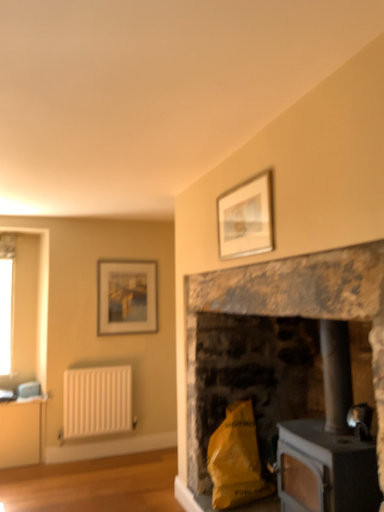
Question: Can you confirm if rustic stone fireplace at center is bigger than white textured radiator at left?

Choices:
 (A) yes
 (B) no

Answer: (A)

Question: From a real-world perspective, does rustic stone fireplace at center stand above white textured radiator at left?

Choices:
 (A) yes
 (B) no

Answer: (A)

Question: Can we say rustic stone fireplace at center lies outside white textured radiator at left?

Choices:
 (A) no
 (B) yes

Answer: (B)

Question: Can you confirm if rustic stone fireplace at center is wider than white textured radiator at left?

Choices:
 (A) yes
 (B) no

Answer: (A)

Question: Is rustic stone fireplace at center taller than white textured radiator at left?

Choices:
 (A) no
 (B) yes

Answer: (B)

Question: From their relative heights in the image, would you say black matte wood burning stove at lower right is taller or shorter than matte wooden picture frame at upper left, the second picture frame from the front?

Choices:
 (A) short
 (B) tall

Answer: (B)

Question: In the image, is black matte wood burning stove at lower right on the left side or the right side of matte wooden picture frame at upper left, the second picture frame from the front?

Choices:
 (A) right
 (B) left

Answer: (A)

Question: In the image, is black matte wood burning stove at lower right positioned in front of or behind matte wooden picture frame at upper left, which appears as the first picture frame when viewed from the back?

Choices:
 (A) behind
 (B) front

Answer: (B)

Question: From a real-world perspective, is black matte wood burning stove at lower right above or below matte wooden picture frame at upper left, positioned as the 1th picture frame in bottom-to-top order?

Choices:
 (A) below
 (B) above

Answer: (A)

Question: From a real-world perspective, is black matte wood burning stove at lower right physically located above or below yellow paper bag at lower center?

Choices:
 (A) above
 (B) below

Answer: (A)

Question: Is black matte wood burning stove at lower right taller or shorter than yellow paper bag at lower center?

Choices:
 (A) short
 (B) tall

Answer: (B)

Question: Considering the positions of black matte wood burning stove at lower right and yellow paper bag at lower center in the image, is black matte wood burning stove at lower right wider or thinner than yellow paper bag at lower center?

Choices:
 (A) thin
 (B) wide

Answer: (B)

Question: Considering the relative positions of black matte wood burning stove at lower right and yellow paper bag at lower center in the image provided, is black matte wood burning stove at lower right to the left or to the right of yellow paper bag at lower center?

Choices:
 (A) left
 (B) right

Answer: (B)

Question: Is matte silver picture frame at upper center, the 1th picture frame when ordered from top to bottom, bigger or smaller than black matte wood burning stove at lower right?

Choices:
 (A) big
 (B) small

Answer: (B)

Question: From their relative heights in the image, would you say matte silver picture frame at upper center, the 2th picture frame viewed from the back, is taller or shorter than black matte wood burning stove at lower right?

Choices:
 (A) tall
 (B) short

Answer: (B)